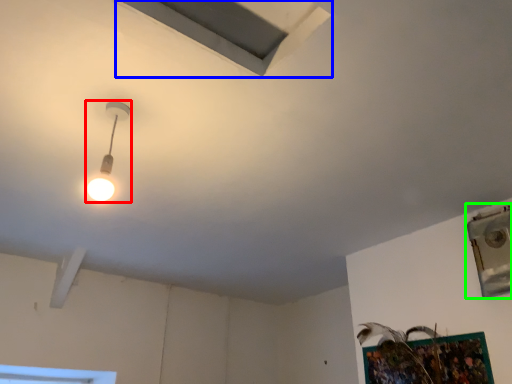
Question: Which is farther away from lamp (highlighted by a red box)? exhaust hood (highlighted by a blue box) or window (highlighted by a green box)?

Choices:
 (A) exhaust hood
 (B) window

Answer: (B)